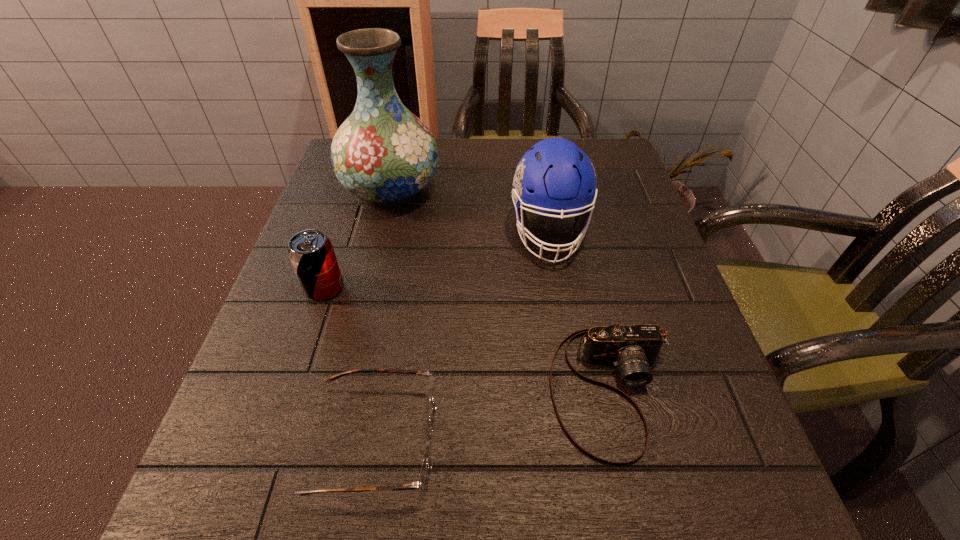
This screenshot has height=540, width=960. I want to click on vacant position in the image that satisfies the following two spatial constraints: 1. on the front-facing side of the camera; 2. on the front-facing side of the spectacles, so click(x=622, y=440).